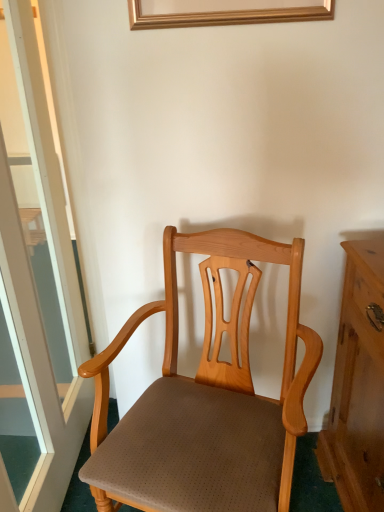
Question: In terms of width, does transparent glass door at left look wider or thinner when compared to light brown wood chair at center?

Choices:
 (A) wide
 (B) thin

Answer: (B)

Question: Which is correct: transparent glass door at left is inside light brown wood chair at center, or outside of it?

Choices:
 (A) inside
 (B) outside

Answer: (B)

Question: From the image's perspective, is transparent glass door at left above or below light brown wood chair at center?

Choices:
 (A) above
 (B) below

Answer: (A)

Question: Visually, is light brown wood chair at center positioned to the left or to the right of transparent glass door at left?

Choices:
 (A) left
 (B) right

Answer: (B)

Question: From their relative heights in the image, would you say light brown wood chair at center is taller or shorter than transparent glass door at left?

Choices:
 (A) tall
 (B) short

Answer: (B)

Question: Is point [273, 413] closer or farther from the camera than point [76, 302]?

Choices:
 (A) farther
 (B) closer

Answer: (B)

Question: Considering the positions of light brown wood chair at center and transparent glass door at left in the image, is light brown wood chair at center bigger or smaller than transparent glass door at left?

Choices:
 (A) big
 (B) small

Answer: (A)